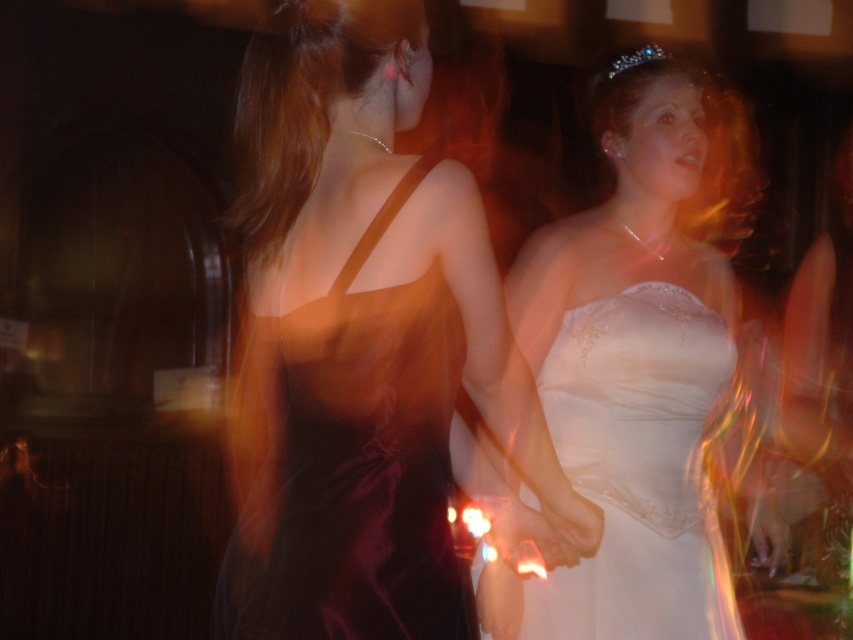
You are a photographer at a wedding reception. You notice the satin burgundy dress at center and the clear crystal tiara at upper right in your viewfinder. Which object is closer to the camera?

The satin burgundy dress at center is positioned under the clear crystal tiara at upper right, meaning it is closer to the camera than the tiara.